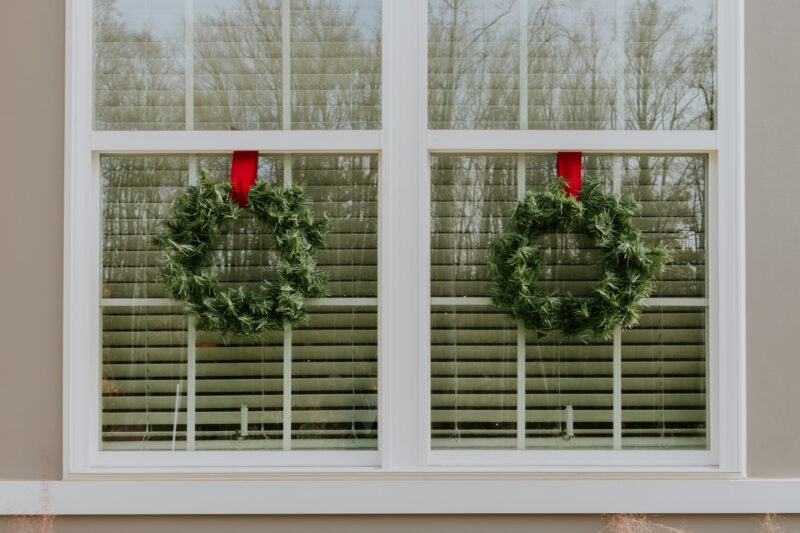
Find the location of `right wreath`. right wreath is located at coordinates (629, 286).